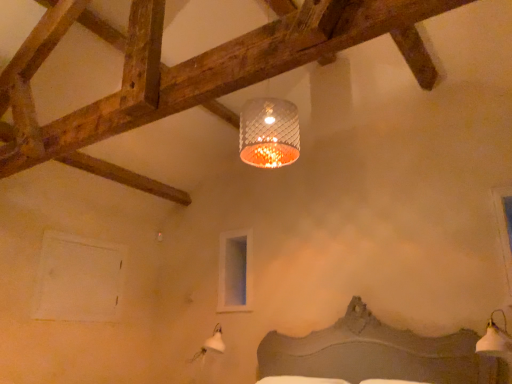
What do you see at coordinates (78, 279) in the screenshot? The height and width of the screenshot is (384, 512). I see `white matte window at lower left, the second window positioned from the front` at bounding box center [78, 279].

Locate an element on the screen. The image size is (512, 384). white matte window at lower left, which is counted as the third window, starting from the right is located at coordinates (78, 279).

In order to face clear glass window at upper center, the 1th window in the back-to-front sequence, should I rotate leftwards or rightwards?

→ Turn left approximately 2.978 degrees to face it.

This screenshot has height=384, width=512. Describe the element at coordinates (234, 272) in the screenshot. I see `clear glass window at upper center, marked as the second window in a left-to-right arrangement` at that location.

The image size is (512, 384). Identify the location of white matte window at lower left, placed as the 1th window when sorted from left to right. (78, 279).

Is transparent glass window at upper right, the 3th window from the left, taller or shorter than white glossy lampshade at lower right?

transparent glass window at upper right, the 3th window from the left, is taller than white glossy lampshade at lower right.

Is white glossy lampshade at lower right located within transparent glass window at upper right, the 3th window from the left?

No, white glossy lampshade at lower right is not inside transparent glass window at upper right, the 3th window from the left.

Considering the relative positions of transparent glass window at upper right, which is the first window from right to left, and white glossy lampshade at lower right in the image provided, is transparent glass window at upper right, which is the first window from right to left, to the right of white glossy lampshade at lower right from the viewer's perspective?

Correct, you'll find transparent glass window at upper right, which is the first window from right to left, to the right of white glossy lampshade at lower right.

Can you confirm if transparent glass window at upper right, the third window in the back-to-front sequence, is thinner than white glossy lampshade at lower right?

Yes, transparent glass window at upper right, the third window in the back-to-front sequence, is thinner than white glossy lampshade at lower right.

Locate an element on the screen. This screenshot has height=384, width=512. the 1st window counting from the left of the transparent glass window at upper right, which is the first window from right to left is located at coordinates (234, 272).

Is transparent glass window at upper right, which is the first window from right to left, looking in the opposite direction of clear glass window at upper center, which is the 2th window in right-to-left order?

No.

Looking at the image, does transparent glass window at upper right, the third window in the back-to-front sequence, seem bigger or smaller compared to clear glass window at upper center, the 1th window in the back-to-front sequence?

transparent glass window at upper right, the third window in the back-to-front sequence, is smaller than clear glass window at upper center, the 1th window in the back-to-front sequence.

Can we say transparent glass window at upper right, the 3th window from the left, lies outside clear glass window at upper center, which is the 2th window in right-to-left order?

Yes, transparent glass window at upper right, the 3th window from the left, is not within clear glass window at upper center, which is the 2th window in right-to-left order.

Are white glossy lampshade at lower right and transparent glass window at upper right, the 3th window from the left, far apart?

white glossy lampshade at lower right is actually quite close to transparent glass window at upper right, the 3th window from the left.

Is white glossy lampshade at lower right wider or thinner than transparent glass window at upper right, the third window in the back-to-front sequence?

Clearly, white glossy lampshade at lower right has more width compared to transparent glass window at upper right, the third window in the back-to-front sequence.

From the image's perspective, which is below, white glossy lampshade at lower right or transparent glass window at upper right, the third window in the back-to-front sequence?

white glossy lampshade at lower right, from the image's perspective.

Is white glossy lampshade at lower right oriented away from transparent glass window at upper right, the 3th window from the left?

No, white glossy lampshade at lower right's orientation is not away from transparent glass window at upper right, the 3th window from the left.

Visually, is clear glass window at upper center, the third window when ordered from front to back, positioned to the left or to the right of white matte window at lower left, which is counted as the third window, starting from the right?

Clearly, clear glass window at upper center, the third window when ordered from front to back, is on the right of white matte window at lower left, which is counted as the third window, starting from the right, in the image.

From a real-world perspective, which window is the 2nd one underneath the clear glass window at upper center, the third window when ordered from front to back? Please provide its 2D coordinates.

[(78, 279)]

Which of these two, clear glass window at upper center, the 1th window in the back-to-front sequence, or white matte window at lower left, the second window positioned from the front, is smaller?

With smaller size is clear glass window at upper center, the 1th window in the back-to-front sequence.

Could you measure the distance between clear glass window at upper center, marked as the second window in a left-to-right arrangement, and white matte window at lower left, which is counted as the third window, starting from the right?

The distance of clear glass window at upper center, marked as the second window in a left-to-right arrangement, from white matte window at lower left, which is counted as the third window, starting from the right, is 1.16 meters.

At what (x,y) coordinates should I click in order to perform the action: click on window that is the 2nd one when counting leftward from the white glossy lampshade at lower right. Please return your answer as a coordinate pair (x, y). The image size is (512, 384). Looking at the image, I should click on (78, 279).

From the picture: What's the angular difference between white matte window at lower left, placed as the 1th window when sorted from left to right, and white glossy lampshade at lower right's facing directions?

The facing directions of white matte window at lower left, placed as the 1th window when sorted from left to right, and white glossy lampshade at lower right are 87.2 degrees apart.

Measure the distance from white matte window at lower left, which is counted as the third window, starting from the right, to white glossy lampshade at lower right.

The distance of white matte window at lower left, which is counted as the third window, starting from the right, from white glossy lampshade at lower right is 2.99 meters.

Could you tell me if white matte window at lower left, the second window positioned from the front, is facing white glossy lampshade at lower right?

Yes, white matte window at lower left, the second window positioned from the front, is facing white glossy lampshade at lower right.

Can you see transparent glass window at upper right, which is the first window from right to left, touching white matte window at lower left, the second window positioned from the front?

transparent glass window at upper right, which is the first window from right to left, is not next to white matte window at lower left, the second window positioned from the front, and they're not touching.

Looking at their sizes, would you say transparent glass window at upper right, positioned as the 1th window in front-to-back order, is wider or thinner than white matte window at lower left, which is counted as the third window, starting from the right?

transparent glass window at upper right, positioned as the 1th window in front-to-back order, is thinner than white matte window at lower left, which is counted as the third window, starting from the right.

From a real-world perspective, is transparent glass window at upper right, which is the first window from right to left, physically located above or below white matte window at lower left, which is counted as the third window, starting from the right?

From a real-world perspective, transparent glass window at upper right, which is the first window from right to left, is physically above white matte window at lower left, which is counted as the third window, starting from the right.

You are a GUI agent. You are given a task and a screenshot of the screen. Output one action in this format:
    pyautogui.click(x=<x>, y=<y>)
    Task: Click on the 2nd window to the left when counting from the transparent glass window at upper right, the third window in the back-to-front sequence
    This screenshot has width=512, height=384.
    Given the screenshot: What is the action you would take?
    pyautogui.click(x=78, y=279)

Which is behind, white matte window at lower left, placed as the 1th window when sorted from left to right, or transparent glass window at upper right, which is the first window from right to left?

white matte window at lower left, placed as the 1th window when sorted from left to right, is behind.

How different are the orientations of white matte window at lower left, which is counted as the third window, starting from the right, and transparent glass window at upper right, positioned as the 1th window in front-to-back order, in degrees?

white matte window at lower left, which is counted as the third window, starting from the right, and transparent glass window at upper right, positioned as the 1th window in front-to-back order, are facing 88.6 degrees away from each other.

Consider the image. Is white matte window at lower left, the second window positioned from the front, positioned far away from transparent glass window at upper right, positioned as the 1th window in front-to-back order?

Indeed, white matte window at lower left, the second window positioned from the front, is not near transparent glass window at upper right, positioned as the 1th window in front-to-back order.

I want to click on lamp on the left of transparent glass window at upper right, the third window in the back-to-front sequence, so click(x=495, y=339).

The image size is (512, 384). In order to click on the 2nd window behind when counting from the transparent glass window at upper right, the third window in the back-to-front sequence in this screenshot , I will do `click(234, 272)`.

Considering their positions, is transparent glass window at upper right, positioned as the 1th window in front-to-back order, positioned closer to clear glass window at upper center, which is the 2th window in right-to-left order, than white glossy lampshade at lower right?

The object closer to clear glass window at upper center, which is the 2th window in right-to-left order, is white glossy lampshade at lower right.

When comparing their distances from white matte window at lower left, which is counted as the third window, starting from the right, does transparent glass window at upper right, which is the first window from right to left, or white glossy lampshade at lower right seem closer?

white glossy lampshade at lower right is positioned closer to the anchor white matte window at lower left, which is counted as the third window, starting from the right.

Considering their positions, is transparent glass window at upper right, which is the first window from right to left, positioned further to clear glass window at upper center, which is the 2th window in right-to-left order, than white matte window at lower left, which is counted as the third window, starting from the right?

transparent glass window at upper right, which is the first window from right to left.

Considering their positions, is white glossy lampshade at lower right positioned closer to transparent glass window at upper right, the third window in the back-to-front sequence, than clear glass window at upper center, which is the 2th window in right-to-left order?

white glossy lampshade at lower right.

Estimate the real-world distances between objects in this image. Which object is further from white glossy lampshade at lower right, transparent glass window at upper right, the 3th window from the left, or white matte window at lower left, the second window positioned from the front?

white matte window at lower left, the second window positioned from the front, is positioned further to the anchor white glossy lampshade at lower right.

Looking at the image, which one is located further to white glossy lampshade at lower right, clear glass window at upper center, which is the 2th window in right-to-left order, or transparent glass window at upper right, the 3th window from the left?

clear glass window at upper center, which is the 2th window in right-to-left order, lies further to white glossy lampshade at lower right than the other object.

Considering their positions, is white glossy lampshade at lower right positioned further to white matte window at lower left, which is counted as the third window, starting from the right, than transparent glass window at upper right, which is the first window from right to left?

transparent glass window at upper right, which is the first window from right to left, is positioned further to the anchor white matte window at lower left, which is counted as the third window, starting from the right.

When comparing their distances from transparent glass window at upper right, the third window in the back-to-front sequence, does white matte window at lower left, placed as the 1th window when sorted from left to right, or clear glass window at upper center, the 1th window in the back-to-front sequence, seem further?

Among the two, white matte window at lower left, placed as the 1th window when sorted from left to right, is located further to transparent glass window at upper right, the third window in the back-to-front sequence.

At what (x,y) coordinates should I click in order to perform the action: click on lamp between clear glass window at upper center, which is the 2th window in right-to-left order, and transparent glass window at upper right, the third window in the back-to-front sequence, from left to right. Please return your answer as a coordinate pair (x, y). Looking at the image, I should click on (495, 339).

This screenshot has width=512, height=384. Find the location of `window located between white matte window at lower left, the second window positioned from the front, and transparent glass window at upper right, positioned as the 1th window in front-to-back order, in the left-right direction`. window located between white matte window at lower left, the second window positioned from the front, and transparent glass window at upper right, positioned as the 1th window in front-to-back order, in the left-right direction is located at coordinates (234, 272).

Locate an element on the screen. lamp located between white matte window at lower left, the second window positioned from the front, and transparent glass window at upper right, which is the first window from right to left, in the left-right direction is located at coordinates (495, 339).

I want to click on window located between white matte window at lower left, the second window positioned from the front, and white glossy lampshade at lower right in the left-right direction, so click(234, 272).